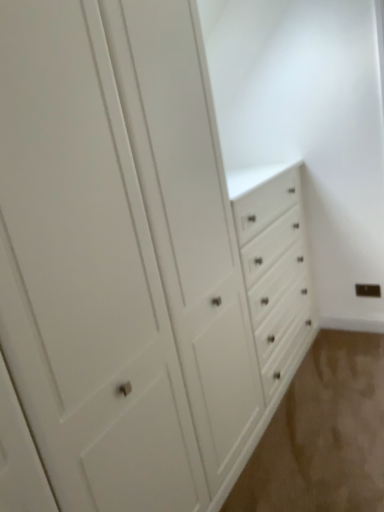
The image size is (384, 512). Describe the element at coordinates (323, 434) in the screenshot. I see `white glossy drawer at lower right` at that location.

The width and height of the screenshot is (384, 512). What are the coordinates of `white glossy drawer at lower right` in the screenshot? It's located at (323, 434).

At what (x,y) coordinates should I click in order to perform the action: click on white glossy drawer at lower right. Please return your answer as a coordinate pair (x, y). Looking at the image, I should click on (323, 434).